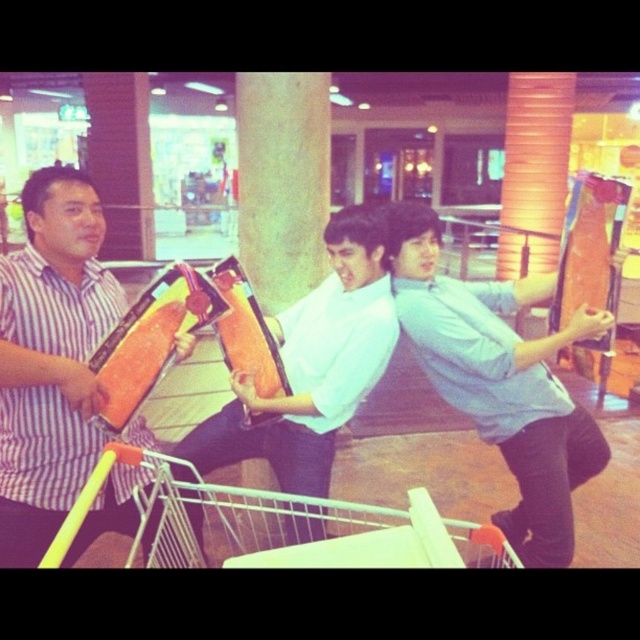
Can you confirm if light blue shirt at center is bigger than white metal shopping cart at lower left?

No, light blue shirt at center is not bigger than white metal shopping cart at lower left.

From the picture: Who is positioned more to the left, light blue shirt at center or white metal shopping cart at lower left?

white metal shopping cart at lower left

Between point (465, 348) and point (168, 467), which one is positioned in front?

Point (168, 467)

I want to click on light blue shirt at center, so click(500, 380).

Who is positioned more to the left, matte striped shirt at left or white metal shopping cart at lower left?

matte striped shirt at left is more to the left.

How far apart are matte striped shirt at left and white metal shopping cart at lower left?

matte striped shirt at left is 21.50 inches away from white metal shopping cart at lower left.

Does point (60, 264) come behind point (173, 545)?

Yes, it is behind point (173, 545).

The width and height of the screenshot is (640, 640). Find the location of `matte striped shirt at left`. matte striped shirt at left is located at coordinates (51, 358).

Does matte striped shirt at left lie behind white matte skateboard at center?

No.

Who is more forward, (74, 324) or (356, 204)?

Point (74, 324)

Find the location of a particular element. This screenshot has width=640, height=640. matte striped shirt at left is located at coordinates coord(51,358).